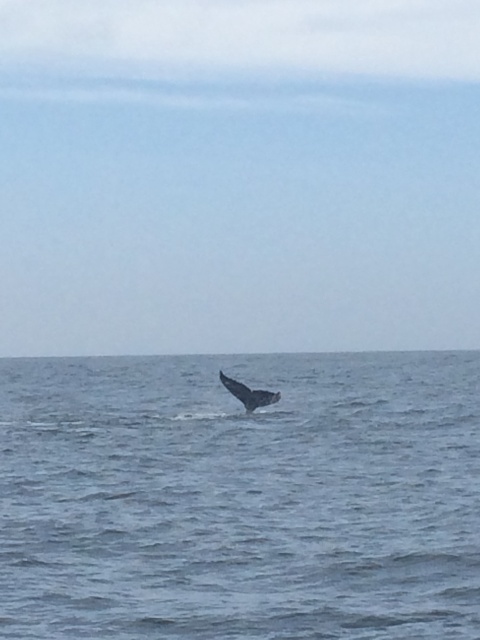
Is blue water at center positioned before gray matte whale at center?

Yes, blue water at center is closer to the viewer.

Is blue water at center above gray matte whale at center?

Incorrect, blue water at center is not positioned above gray matte whale at center.

Which is behind, point (328, 419) or point (260, 401)?

Positioned behind is point (328, 419).

The height and width of the screenshot is (640, 480). I want to click on blue water at center, so click(x=240, y=497).